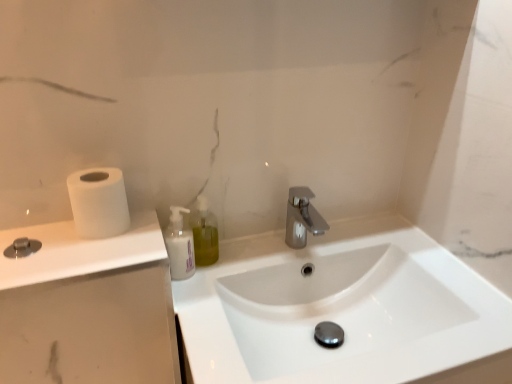
Question: In the image, is translucent plastic soap dispenser at center positioned in front of or behind white glossy sink at center?

Choices:
 (A) front
 (B) behind

Answer: (B)

Question: Is translucent plastic soap dispenser at center spatially inside white glossy sink at center, or outside of it?

Choices:
 (A) inside
 (B) outside

Answer: (B)

Question: Estimate the real-world distances between objects in this image. Which object is farther from the translucent plastic soap dispenser at center?

Choices:
 (A) white matte countertop at left
 (B) white glossy sink at center
 (C) white matte bottle at center
 (D) white matte toilet paper at left
 (E) polished chrome faucet at center

Answer: (B)

Question: Estimate the real-world distances between objects in this image. Which object is closer to the polished chrome faucet at center?

Choices:
 (A) white glossy sink at center
 (B) white matte bottle at center
 (C) translucent plastic soap dispenser at center
 (D) white matte countertop at left
 (E) white matte toilet paper at left

Answer: (C)